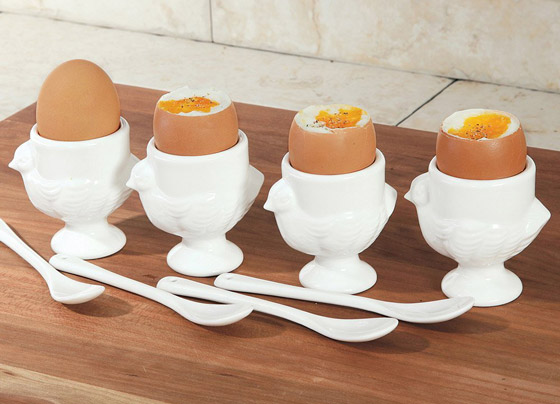
Where is `wooden surface`? This screenshot has width=560, height=404. wooden surface is located at coordinates (454, 331).